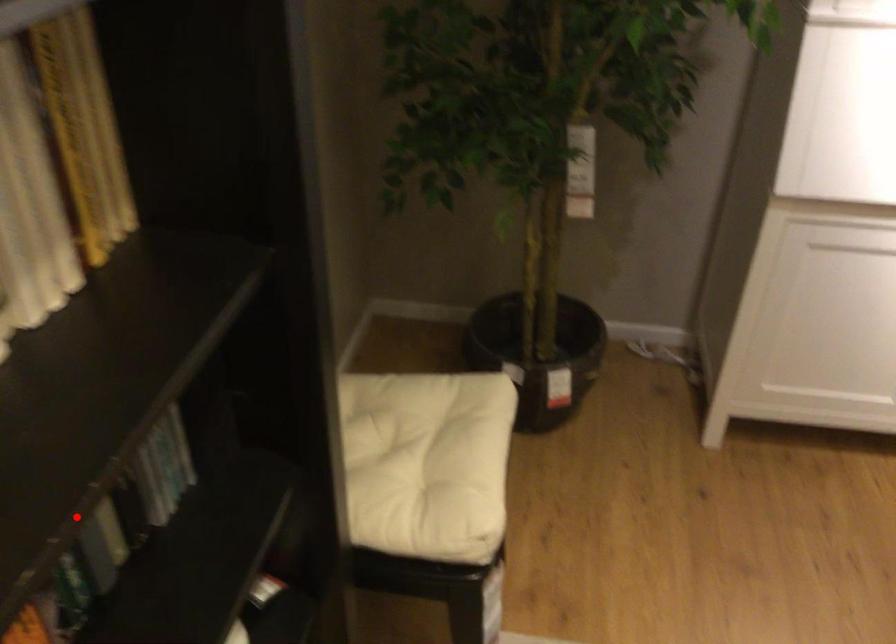
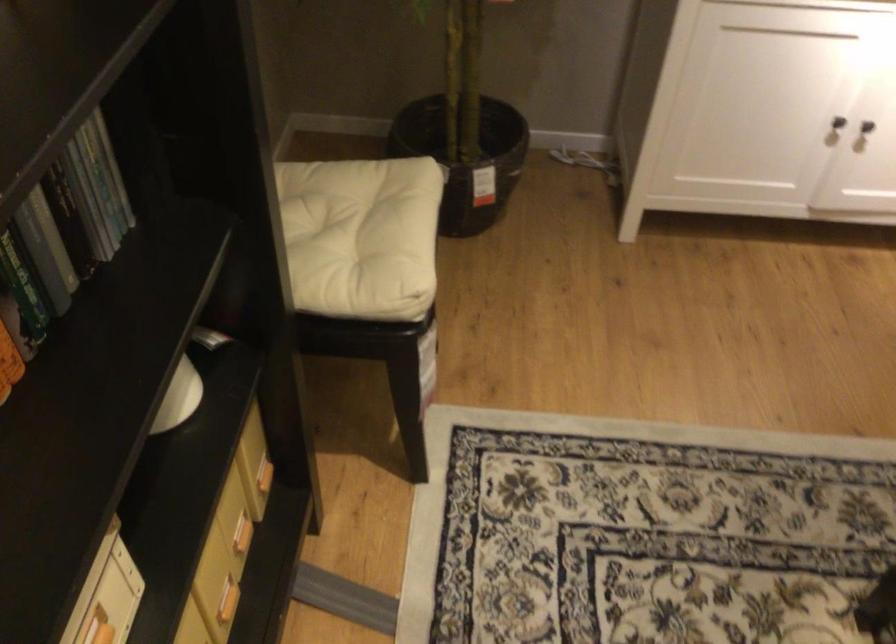
Locate, in the second image, the point that corresponds to the highlighted location in the first image.

(30, 240)